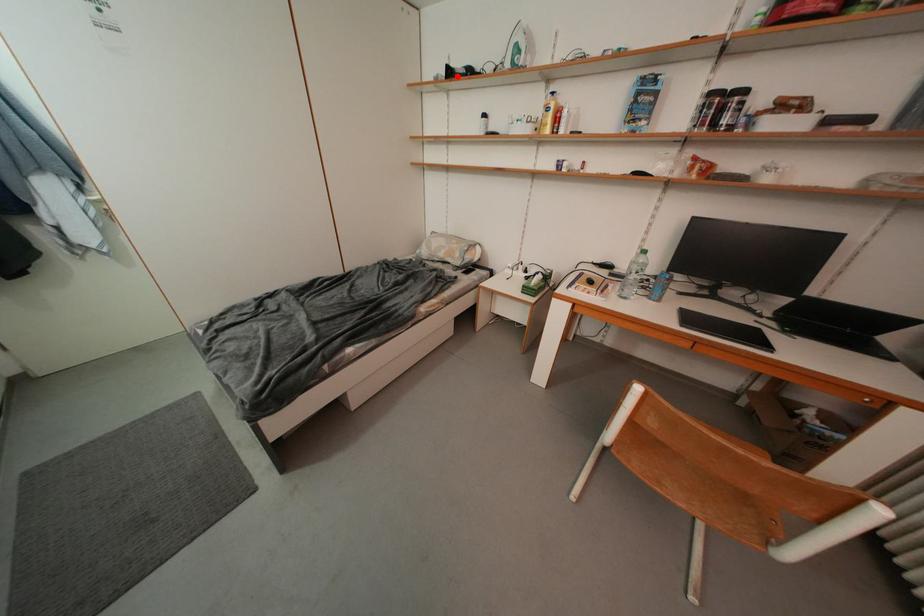
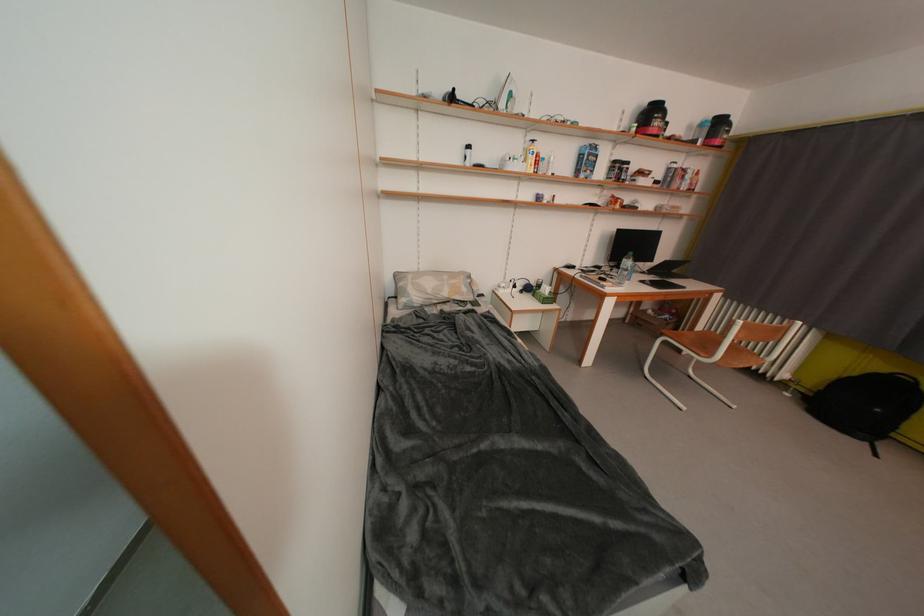
Where in the second image is the point corresponding to the highlighted location from the first image?

(459, 100)